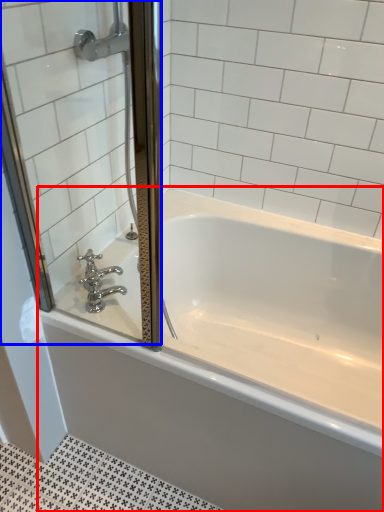
Question: Which object is closer to the camera taking this photo, bathtub (highlighted by a red box) or screen door (highlighted by a blue box)?

Choices:
 (A) bathtub
 (B) screen door

Answer: (B)